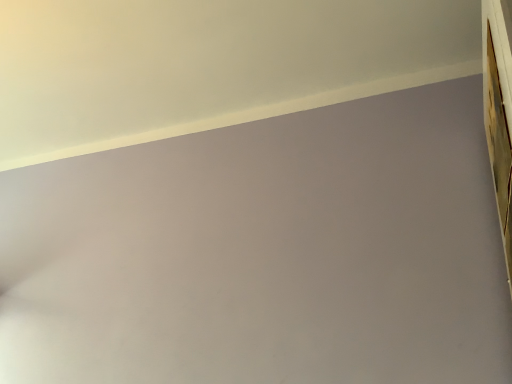
Question: Is white smooth wall at upper left surrounded by wooden frame at upper right?

Choices:
 (A) no
 (B) yes

Answer: (A)

Question: Can you confirm if wooden frame at upper right is smaller than white smooth wall at upper left?

Choices:
 (A) yes
 (B) no

Answer: (A)

Question: Does wooden frame at upper right have a lesser height compared to white smooth wall at upper left?

Choices:
 (A) yes
 (B) no

Answer: (B)

Question: Does wooden frame at upper right have a greater width compared to white smooth wall at upper left?

Choices:
 (A) yes
 (B) no

Answer: (B)

Question: From the image's perspective, is wooden frame at upper right on white smooth wall at upper left?

Choices:
 (A) yes
 (B) no

Answer: (B)

Question: Is wooden frame at upper right outside of white smooth wall at upper left?

Choices:
 (A) yes
 (B) no

Answer: (A)

Question: From a real-world perspective, does white smooth wall at upper left stand above wooden frame at upper right?

Choices:
 (A) no
 (B) yes

Answer: (B)

Question: Is white smooth wall at upper left smaller than wooden frame at upper right?

Choices:
 (A) no
 (B) yes

Answer: (A)

Question: Does white smooth wall at upper left have a lesser height compared to wooden frame at upper right?

Choices:
 (A) yes
 (B) no

Answer: (A)

Question: Does white smooth wall at upper left have a greater height compared to wooden frame at upper right?

Choices:
 (A) no
 (B) yes

Answer: (A)

Question: Is white smooth wall at upper left turned away from wooden frame at upper right?

Choices:
 (A) yes
 (B) no

Answer: (B)

Question: Is white smooth wall at upper left not within wooden frame at upper right?

Choices:
 (A) yes
 (B) no

Answer: (A)

Question: From the image's perspective, is wooden frame at upper right above or below white smooth wall at upper left?

Choices:
 (A) below
 (B) above

Answer: (A)